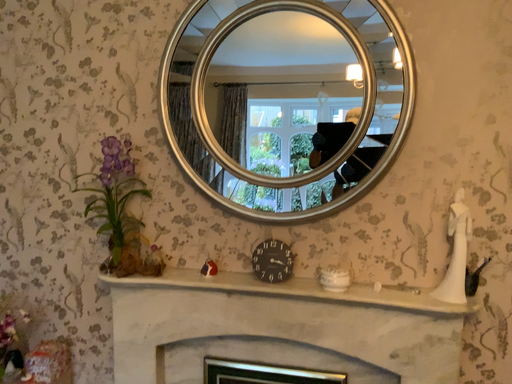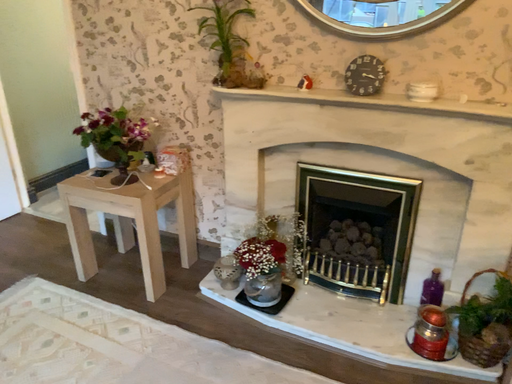
Question: How did the camera likely rotate when shooting the video?

Choices:
 (A) rotated right
 (B) rotated left

Answer: (B)